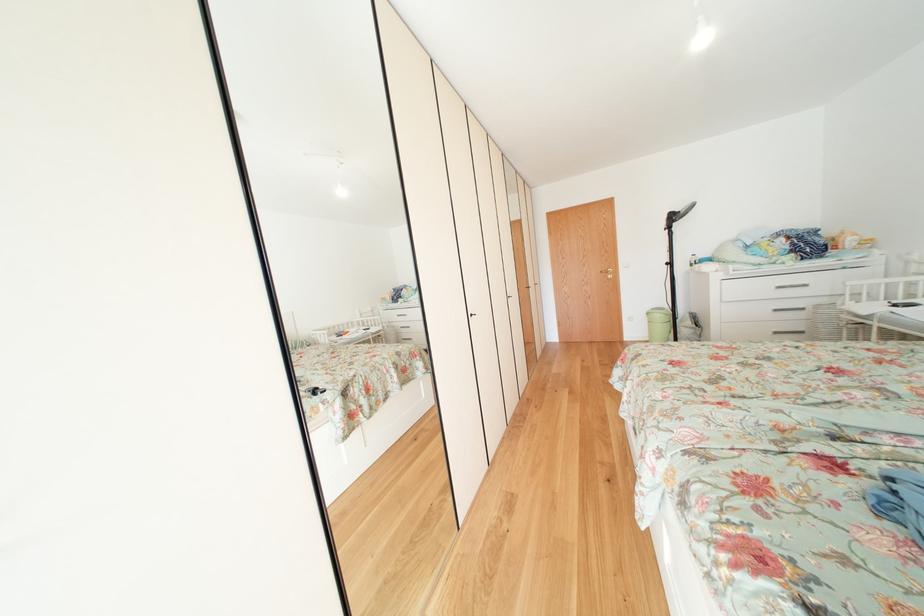
Describe the element at coordinates (609, 272) in the screenshot. I see `the gold door handle` at that location.